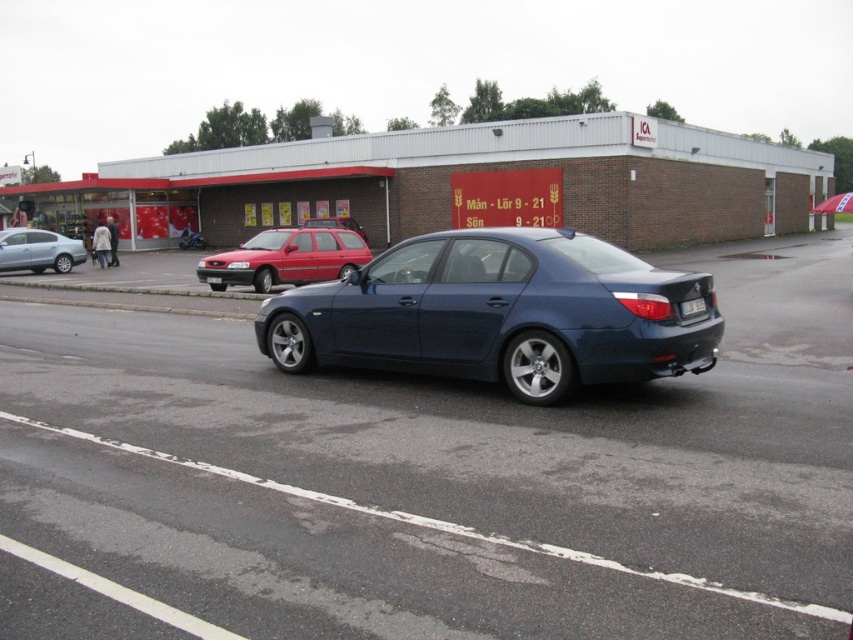
Who is lower down, brick building at center or satin blue sedan at center?

satin blue sedan at center is below.

Does point (398, 182) come closer to viewer compared to point (485, 294)?

No, (398, 182) is further to viewer.

The image size is (853, 640). In order to click on brick building at center in this screenshot , I will do `click(465, 182)`.

Is brick building at center further to camera compared to matte red station wagon at center?

→ Yes.

Is brick building at center positioned before matte red station wagon at center?

No, it is not.

Between point (167, 216) and point (260, 282), which one is positioned in front?

Point (260, 282) is in front.

What are the coordinates of `brick building at center` in the screenshot? It's located at (465, 182).

Is matte red station wagon at center further to camera compared to white plastic license plate at center?

Yes, it is.

This screenshot has width=853, height=640. What do you see at coordinates (286, 259) in the screenshot?
I see `matte red station wagon at center` at bounding box center [286, 259].

What are the coordinates of `matte red station wagon at center` in the screenshot? It's located at (286, 259).

Identify the location of matte red station wagon at center. (286, 259).